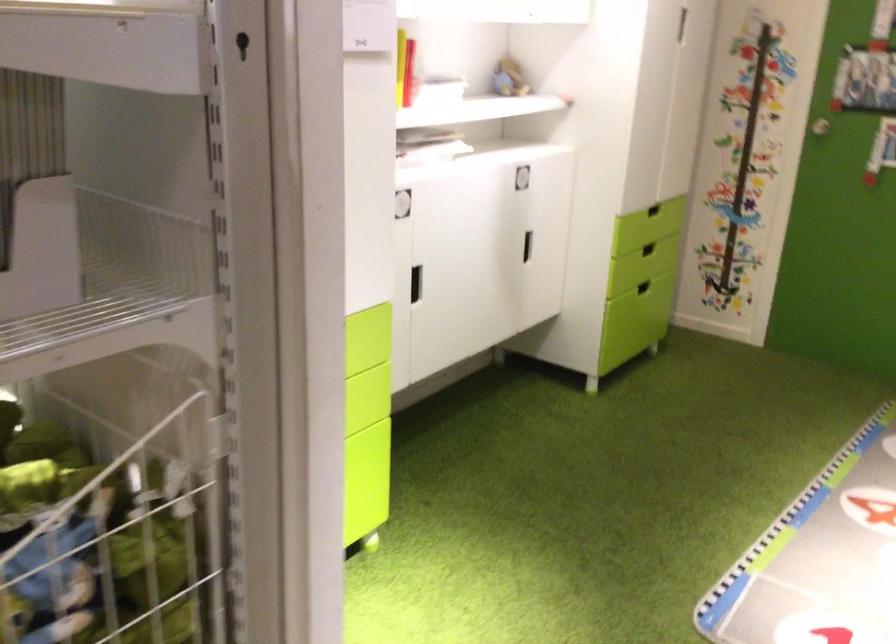
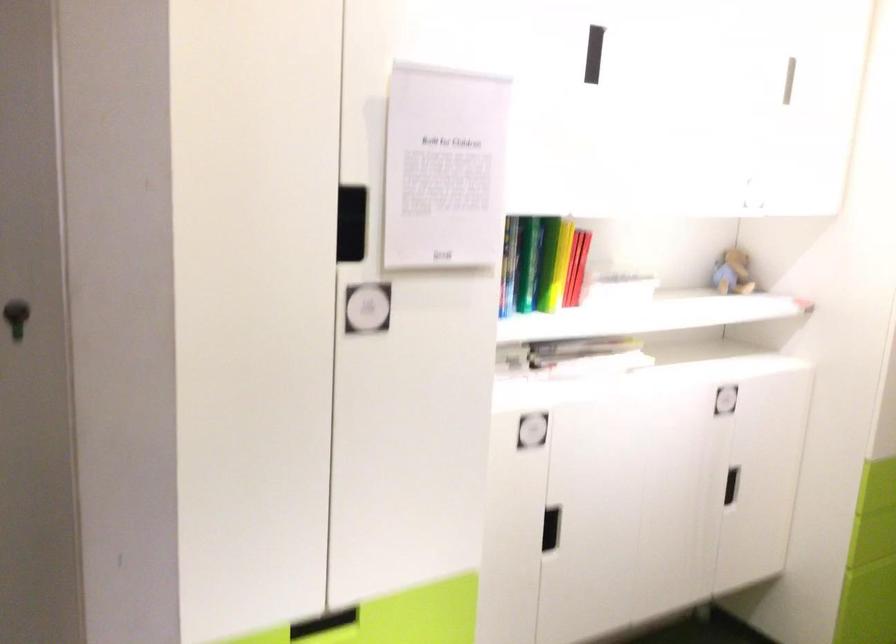
Question: The camera is either moving clockwise (left) or counter-clockwise (right) around the object. The first image is from the beginning of the video and the second image is from the end. Is the camera moving left or right when shooting the video?

Choices:
 (A) Left
 (B) Right

Answer: (B)